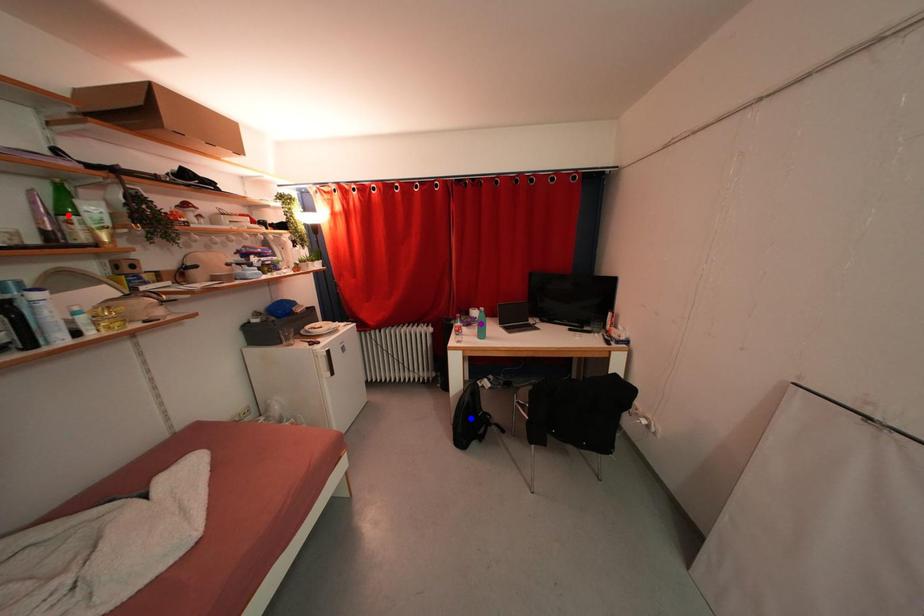
Order these from nearest to farthest:
A) red point
B) purple point
C) blue point

purple point
blue point
red point